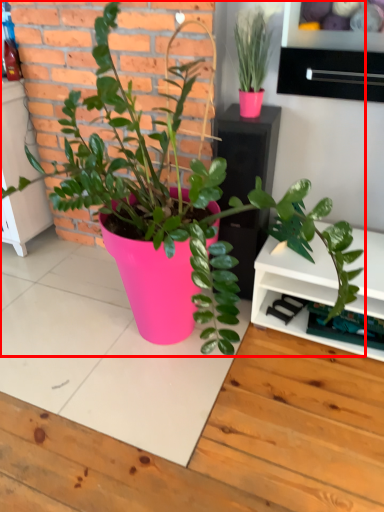
Question: Considering the relative positions of houseplant (annotated by the red box) and drawer in the image provided, where is houseplant (annotated by the red box) located with respect to the staircase?

Choices:
 (A) right
 (B) left

Answer: (B)